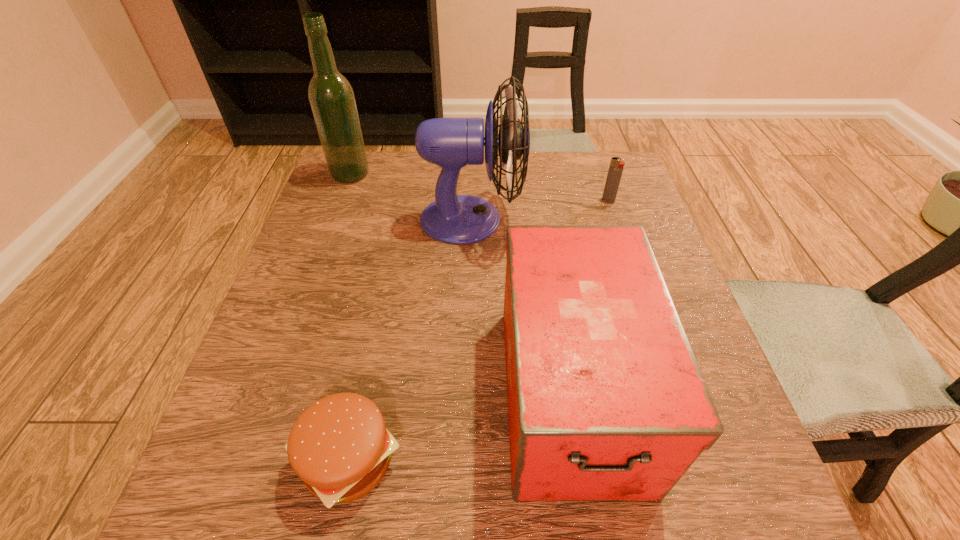
What are the coordinates of `the leftmost object` in the screenshot? It's located at (332, 100).

Where is `liquor`? The image size is (960, 540). liquor is located at coordinates (332, 100).

I want to click on the fourth shortest object, so click(x=454, y=142).

Where is `the third shortest object`? Image resolution: width=960 pixels, height=540 pixels. the third shortest object is located at coordinates (606, 401).

Where is `igniter`? igniter is located at coordinates (616, 167).

Where is `the rightmost object`? the rightmost object is located at coordinates (616, 167).

I want to click on hamburger, so click(x=339, y=446).

Locate an element on the screen. This screenshot has height=540, width=960. blank area located 0.130m on the front of the farthest object is located at coordinates (335, 216).

The height and width of the screenshot is (540, 960). I want to click on vacant space located 0.070m in front of the fan where the airflow is directed, so click(x=551, y=219).

The width and height of the screenshot is (960, 540). I want to click on vacant space located 0.180m on the left of the igniter, so click(x=532, y=200).